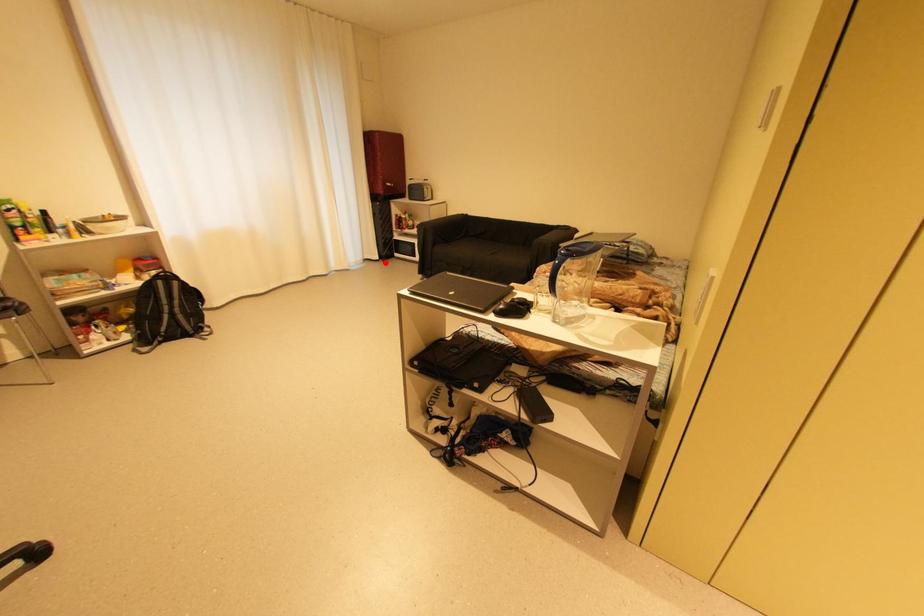
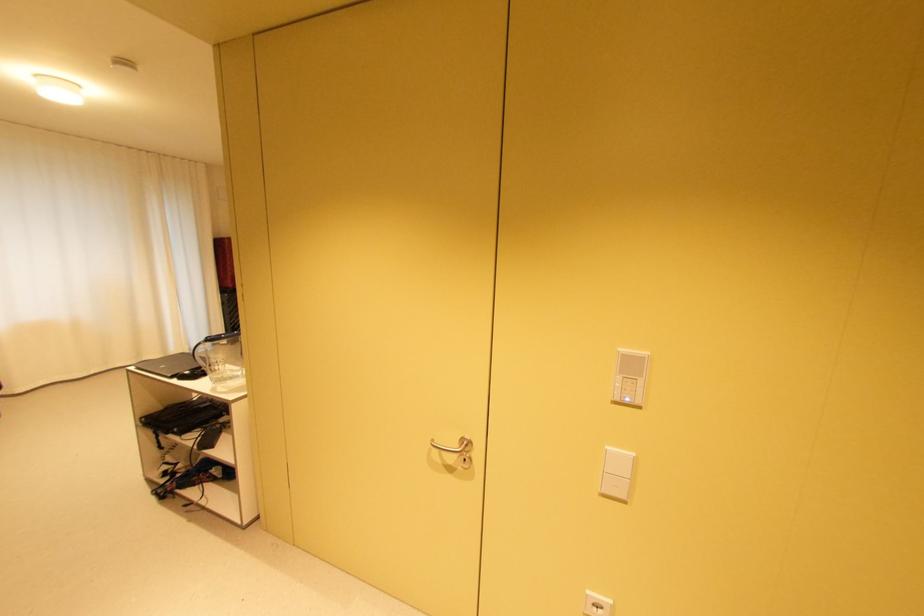
Question: I am providing you with two images of the same scene from different viewpoints. Image1 has a red point marked. In image2, the corresponding 3D location appears at what relative position? Reply with the corresponding letter.

Choices:
 (A) Closer
 (B) Farther

Answer: (B)